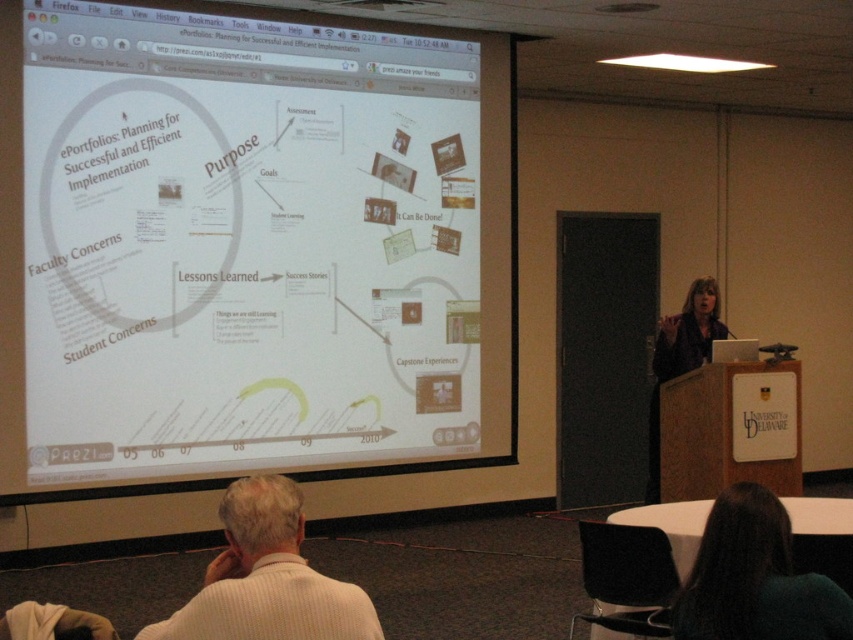
Looking at this image, in the presentation scene, you notice a person with dark brown hair at lower right and someone wearing a matte black shirt at center. Which of these two has a smaller visual presence in the image?

The dark brown hair at lower right occupies less space than the matte black shirt at center, so the dark brown hair at lower right has a smaller visual presence.

Based on the photo, you are an attendee at this presentation and you want to sit between the white textured sweater at lower left and the dark brown hair at lower right. Can you fit comfortably between them?

The white textured sweater at lower left is wider than the dark brown hair at lower right. Since the sweater is wider, there is enough space between them for you to sit comfortably.

You are an attendee at this presentation and you want to describe the spatial arrangement of the objects in the scene to someone who can not see the image. Which object is positioned to the left of the other between the white textured sweater at lower left and the dark brown hair at lower right?

The white textured sweater at lower left is to the left of dark brown hair at lower right.